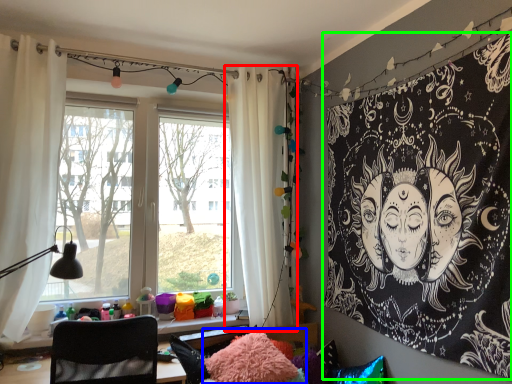
Question: Considering the real-world distances, which object is closest to curtain (highlighted by a red box)? pillow (highlighted by a blue box) or bulletin board (highlighted by a green box).

Choices:
 (A) pillow
 (B) bulletin board

Answer: (A)